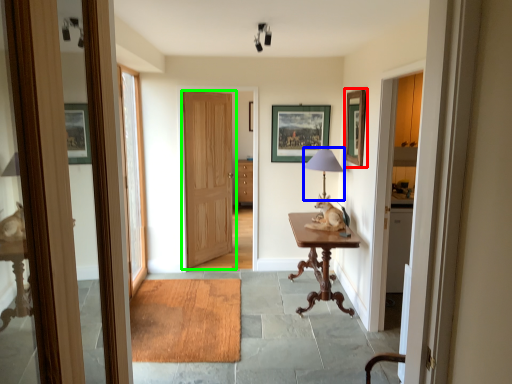
Question: Which is farther away from picture frame (highlighted by a red box)? table lamp (highlighted by a blue box) or door (highlighted by a green box)?

Choices:
 (A) table lamp
 (B) door

Answer: (B)